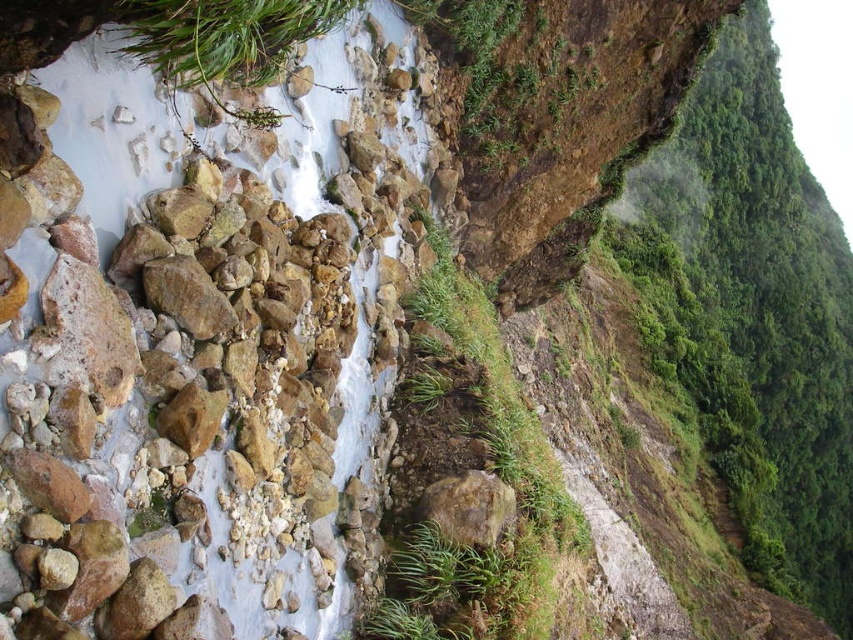
Looking at this image, does green leafy vegetation at upper right lie in front of rusty metallic rock at center?

No, green leafy vegetation at upper right is behind rusty metallic rock at center.

Is green leafy vegetation at upper right shorter than rusty metallic rock at center?

Incorrect, green leafy vegetation at upper right's height does not fall short of rusty metallic rock at center's.

What do you see at coordinates (752, 314) in the screenshot?
I see `green leafy vegetation at upper right` at bounding box center [752, 314].

Locate an element on the screen. green leafy vegetation at upper right is located at coordinates pyautogui.click(x=752, y=314).